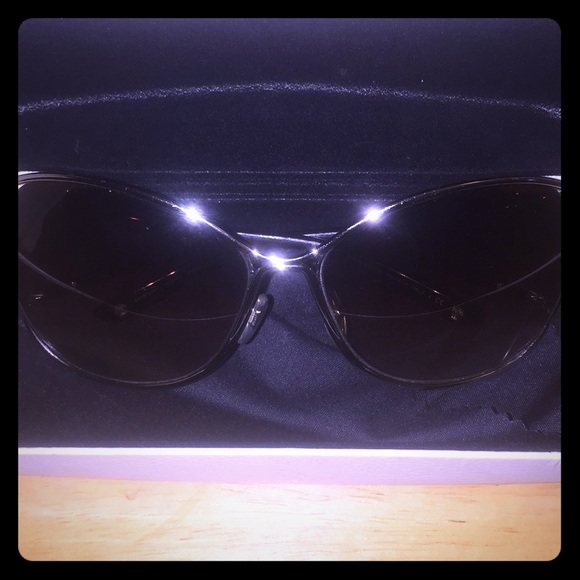
What are the coordinates of `left corner` in the screenshot? It's located at (18, 25).